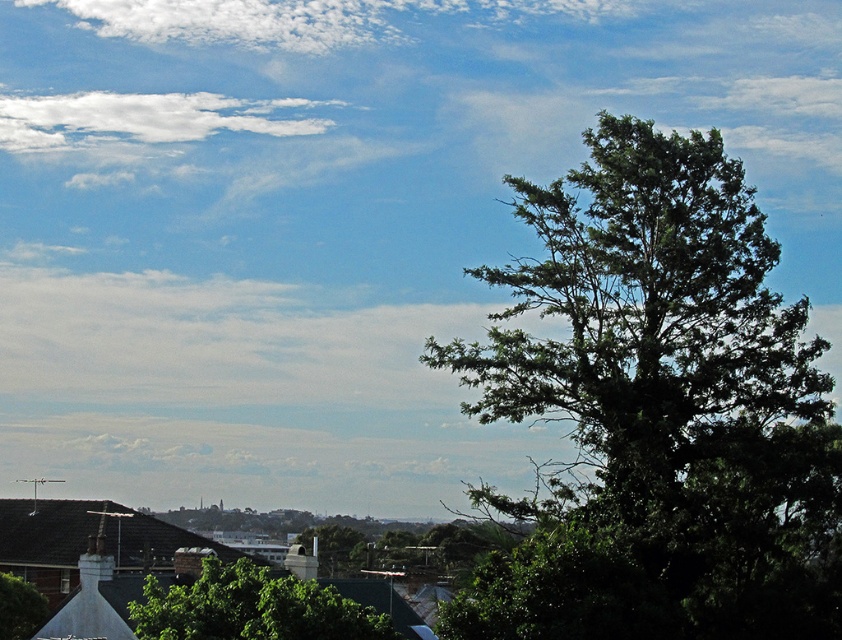
Question: Which object is the farthest from the green leafy tree at right?

Choices:
 (A) white fluffy cloud at upper left
 (B) white fluffy cloud at upper center

Answer: (B)

Question: Is green leafy tree at right wider than green leafy tree at lower left?

Choices:
 (A) yes
 (B) no

Answer: (A)

Question: Is green leafy tree at right bigger than green leafy tree at center?

Choices:
 (A) no
 (B) yes

Answer: (B)

Question: Which of the following is the farthest from the observer?

Choices:
 (A) green leafy tree at lower left
 (B) white fluffy cloud at upper left

Answer: (B)

Question: Which object is positioned farthest from the white fluffy cloud at upper center?

Choices:
 (A) green leafy tree at center
 (B) white fluffy cloud at upper left
 (C) green leafy tree at right
 (D) green leafy tree at lower left

Answer: (C)

Question: Does green leafy tree at center have a lesser width compared to white fluffy cloud at upper left?

Choices:
 (A) no
 (B) yes

Answer: (B)